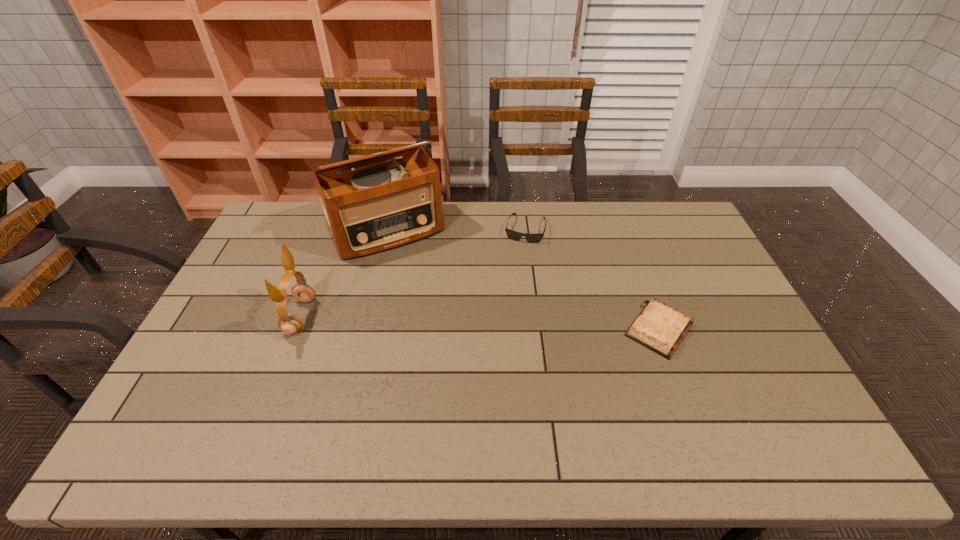
Where is `free space located on the front-facing side of the third object from left to right`? The image size is (960, 540). free space located on the front-facing side of the third object from left to right is located at coordinates (510, 291).

The image size is (960, 540). What are the coordinates of `free space located on the front-facing side of the third object from left to right` in the screenshot? It's located at (510, 293).

Image resolution: width=960 pixels, height=540 pixels. I want to click on vacant space located on the front-facing side of the third object from left to right, so click(x=508, y=299).

In order to click on blank space located on the front panel of the radio receiver in this screenshot , I will do `click(420, 276)`.

You are a GUI agent. You are given a task and a screenshot of the screen. Output one action in this format:
    pyautogui.click(x=<x>, y=<y>)
    Task: Click on the blank space located 0.320m on the front panel of the radio receiver
    The width and height of the screenshot is (960, 540).
    Given the screenshot: What is the action you would take?
    pyautogui.click(x=446, y=322)

You are a GUI agent. You are given a task and a screenshot of the screen. Output one action in this format:
    pyautogui.click(x=<x>, y=<y>)
    Task: Click on the free space located on the front panel of the radio receiver
    This screenshot has width=960, height=540.
    Given the screenshot: What is the action you would take?
    pyautogui.click(x=422, y=282)

I want to click on sunglasses positioned at the far edge, so click(x=514, y=235).

Identify the location of radio receiver located in the far edge section of the desktop. The width and height of the screenshot is (960, 540). coord(381,207).

At what (x,y) coordinates should I click in order to perform the action: click on vacant space at the far edge of the desktop. Please return your answer as a coordinate pair (x, y). This screenshot has height=540, width=960. Looking at the image, I should click on (529, 201).

Locate an element on the screen. free space at the near edge of the desktop is located at coordinates (653, 401).